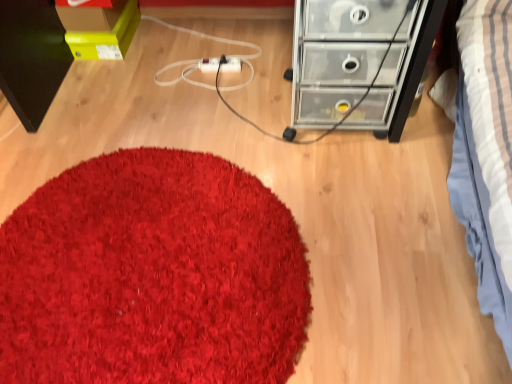
Locate an element on the screen. free space in front of white plastic extension cord at center is located at coordinates (220, 92).